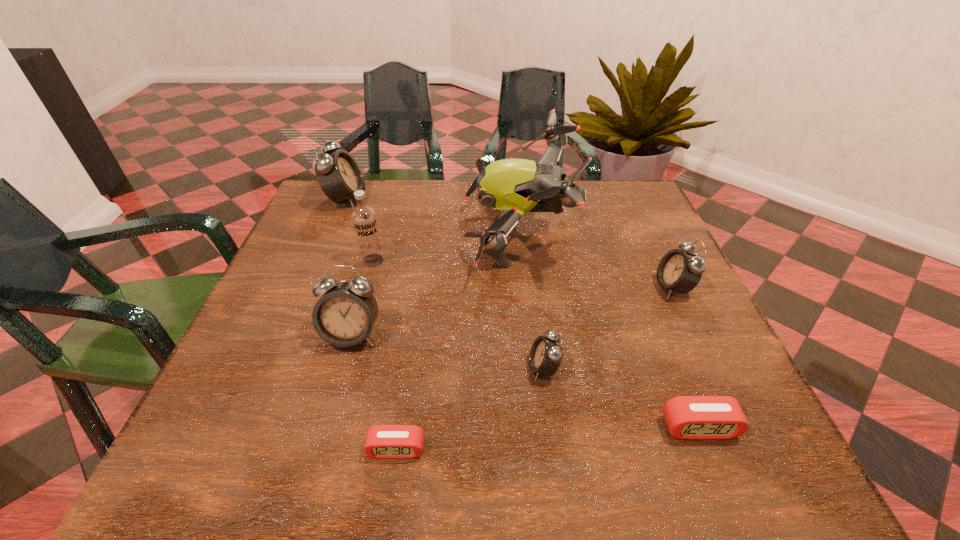
Image resolution: width=960 pixels, height=540 pixels. I want to click on alarm clock that stands as the sixth closest to the green drone, so click(382, 441).

Locate which white alarm clock ranks third in proximity to the fifth tallest alarm clock. Please provide its 2D coordinates. Your answer should be formatted as a tuple, i.e. [(x, y)], where the tuple contains the x and y coordinates of a point satisfying the conditions above.

[(344, 315)]

In order to click on white alarm clock that is the third closest one to the second white alarm clock from right to left in this screenshot , I will do `click(338, 174)`.

At what (x,y) coordinates should I click in order to perform the action: click on vacant position in the image that satisfies the following two spatial constraints: 1. on the face of the fourth shortest object; 2. on the front-facing side of the second shortest object. Please return your answer as a coordinate pair (x, y). The width and height of the screenshot is (960, 540). Looking at the image, I should click on (738, 428).

This screenshot has width=960, height=540. In order to click on vacant space that satisfies the following two spatial constraints: 1. on the face of the third biggest white alarm clock; 2. on the face of the second biggest white alarm clock in this screenshot , I will do `click(695, 335)`.